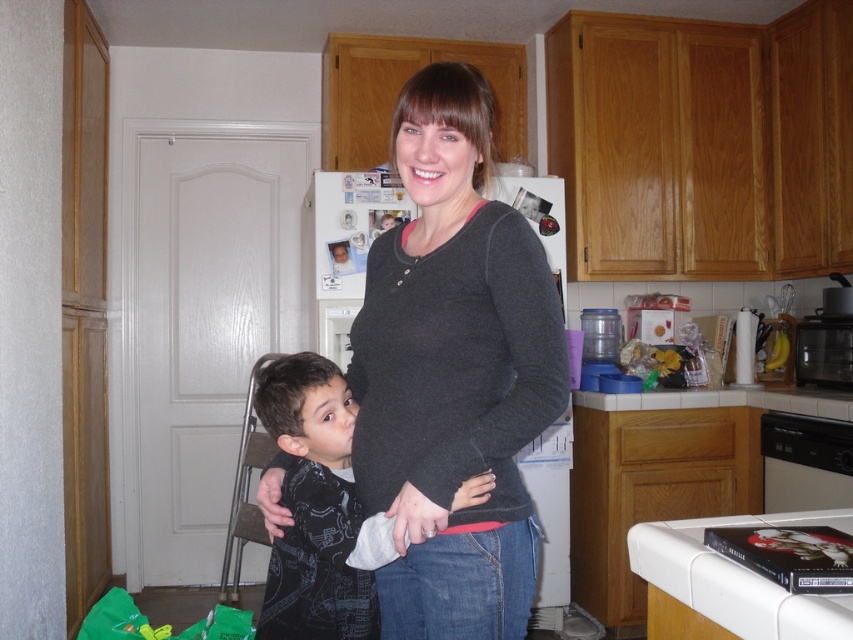
Question: Does dark gray sweater at center come behind dark gray printed shirt at center?

Choices:
 (A) no
 (B) yes

Answer: (A)

Question: Can you confirm if dark gray sweater at center is positioned below dark gray printed shirt at center?

Choices:
 (A) no
 (B) yes

Answer: (A)

Question: From the image, what is the correct spatial relationship of dark gray sweater at center in relation to dark gray printed shirt at center?

Choices:
 (A) above
 (B) below

Answer: (A)